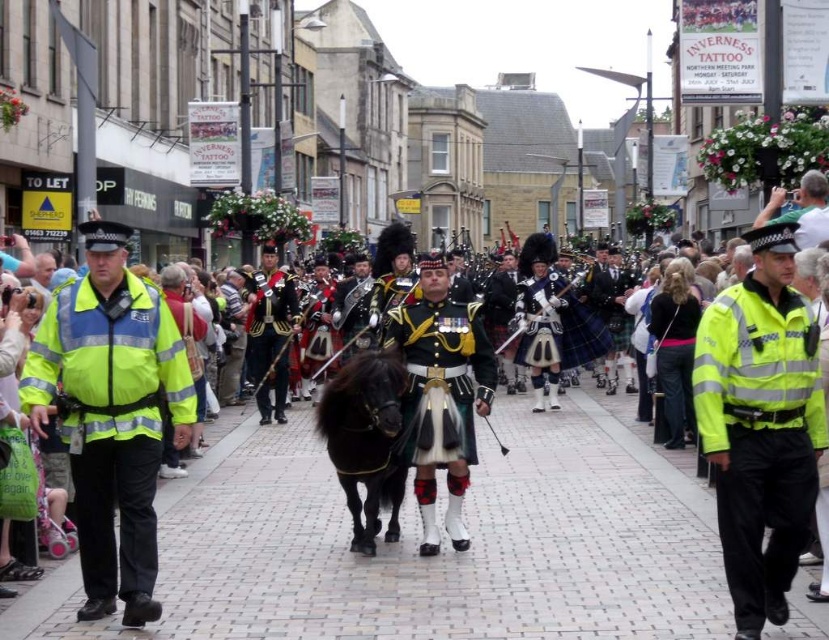
Question: Which object appears farthest from the camera in this image?

Choices:
 (A) high-visibility reflective jacket at center
 (B) black glossy horse at center
 (C) high visibility yellow jacket at left
 (D) shiny gold uniform at center

Answer: (D)

Question: Is brick pavement at center wider than black glossy horse at center?

Choices:
 (A) yes
 (B) no

Answer: (A)

Question: Among these points, which one is farthest from the camera?

Choices:
 (A) (207, 634)
 (B) (414, 410)
 (C) (279, 308)
 (D) (360, 417)

Answer: (C)

Question: Can you confirm if high visibility yellow jacket at left is positioned above high-visibility reflective jacket at center?

Choices:
 (A) yes
 (B) no

Answer: (B)

Question: Is high visibility yellow jacket at left to the right of high-visibility reflective jacket at center from the viewer's perspective?

Choices:
 (A) no
 (B) yes

Answer: (A)

Question: Which of the following is the farthest from the observer?

Choices:
 (A) high visibility yellow jacket at left
 (B) shiny black uniform at center

Answer: (B)